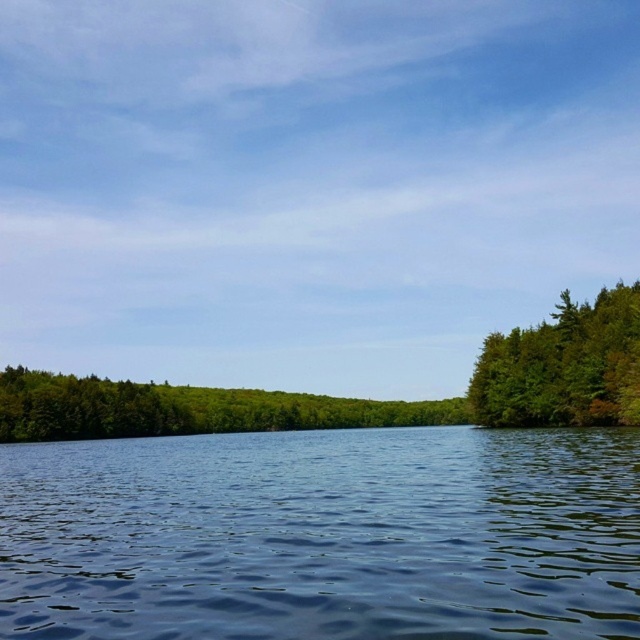
Question: Does green leafy trees at center have a greater width compared to green matte tree at right?

Choices:
 (A) no
 (B) yes

Answer: (B)

Question: Among these points, which one is farthest from the camera?

Choices:
 (A) (61, 406)
 (B) (589, 512)
 (C) (492, 394)

Answer: (A)

Question: Is the position of blue liquid water at center more distant than that of green matte tree at right?

Choices:
 (A) no
 (B) yes

Answer: (A)

Question: Is blue liquid water at center to the left of green leafy trees at center from the viewer's perspective?

Choices:
 (A) yes
 (B) no

Answer: (B)

Question: Which object is positioned closest to the green leafy trees at center?

Choices:
 (A) blue liquid water at center
 (B) green matte tree at right

Answer: (A)

Question: Which object is closer to the camera taking this photo?

Choices:
 (A) green matte tree at right
 (B) blue liquid water at center

Answer: (B)